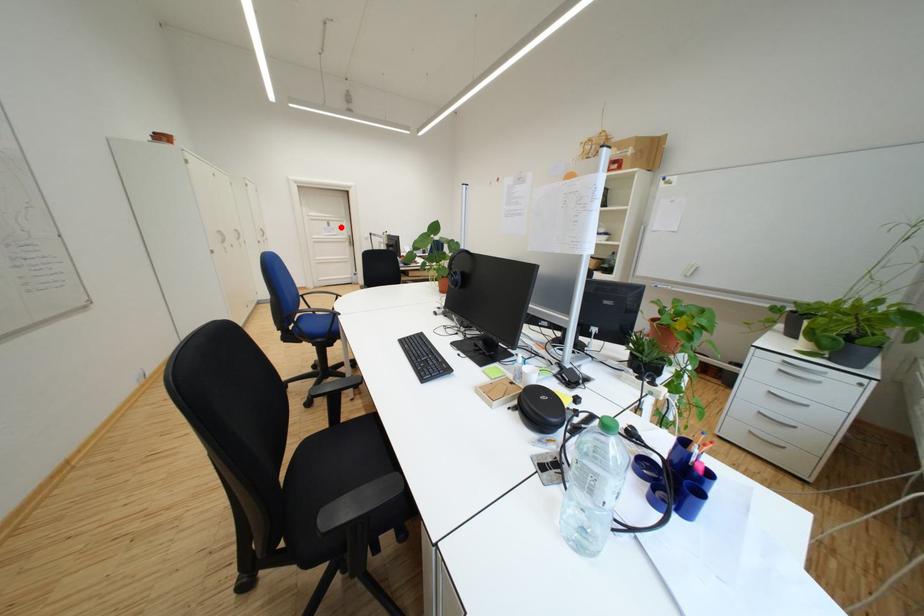
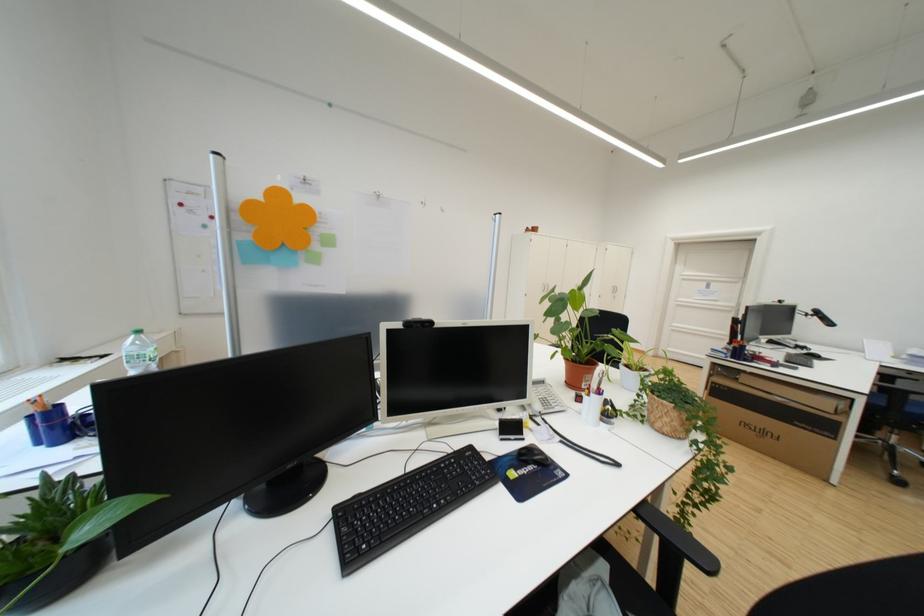
Question: A red point is marked in image1. In image2, is the corresponding 3D point closer to the camera or farther? Reply with the corresponding letter.

Choices:
 (A) The corresponding 3D point is closer.
 (B) The corresponding 3D point is farther.

Answer: (B)